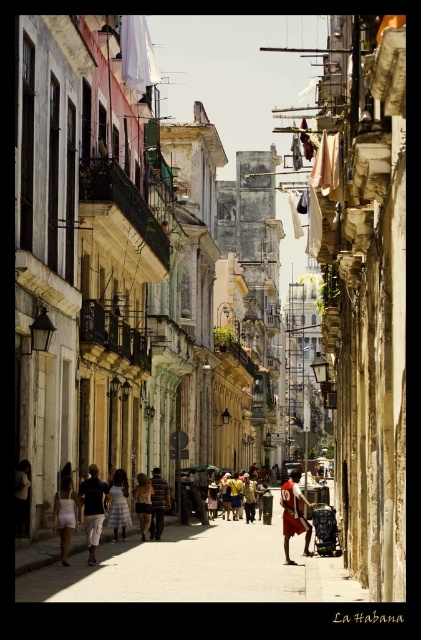
Can you confirm if golden fabric dress at center is smaller than white matte dress at center?

No, golden fabric dress at center is not smaller than white matte dress at center.

Image resolution: width=421 pixels, height=640 pixels. I want to click on golden fabric dress at center, so click(x=143, y=502).

Find the location of a particular element. golden fabric dress at center is located at coordinates (143, 502).

Which of these two, red fabric shorts at center or golden fabric dress at center, stands shorter?

With less height is golden fabric dress at center.

The image size is (421, 640). Find the location of `red fabric shorts at center`. red fabric shorts at center is located at coordinates (293, 515).

The height and width of the screenshot is (640, 421). I want to click on red fabric shorts at center, so click(293, 515).

Does point (100, 493) lie in front of point (138, 500)?

Yes.

Can you confirm if dark brown pants at center is positioned to the right of golden fabric dress at center?

Incorrect, dark brown pants at center is not on the right side of golden fabric dress at center.

Locate an element on the screen. dark brown pants at center is located at coordinates (93, 508).